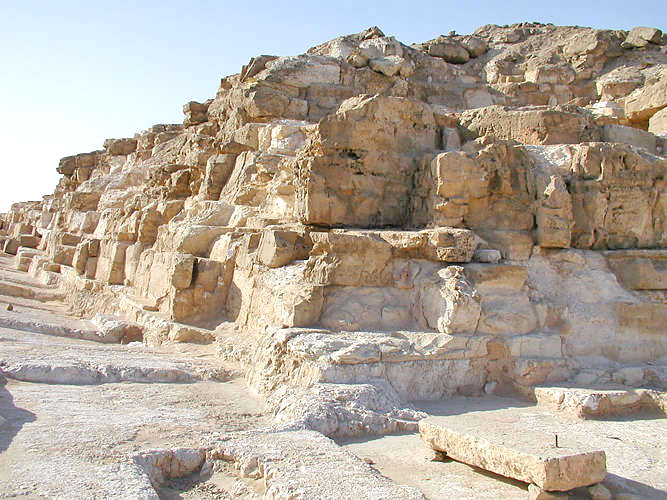
At what (x,y) coordinates should I click in order to perform the action: click on column base. Please return your answer as a coordinate pair (x, y). Looking at the image, I should click on (179, 269), (639, 264), (67, 234).